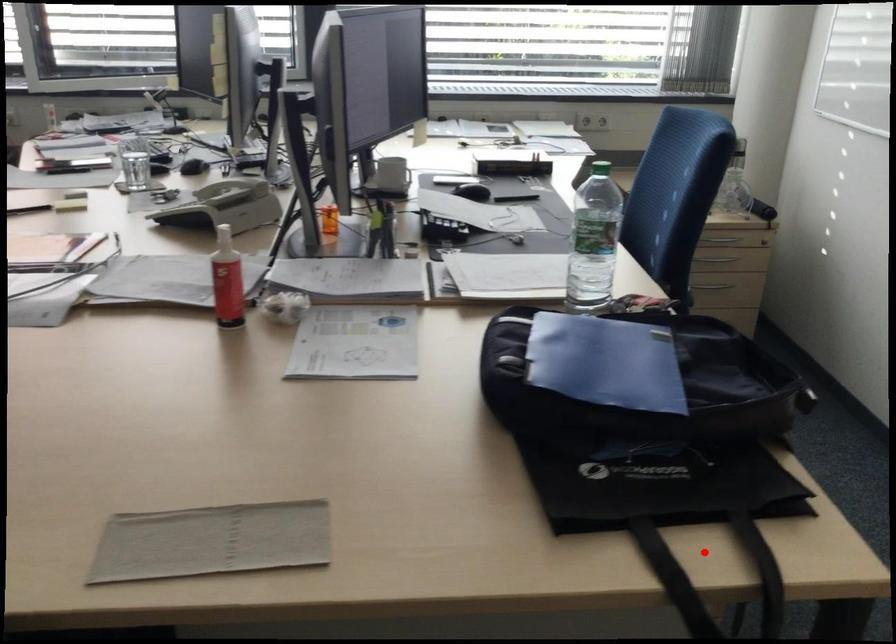
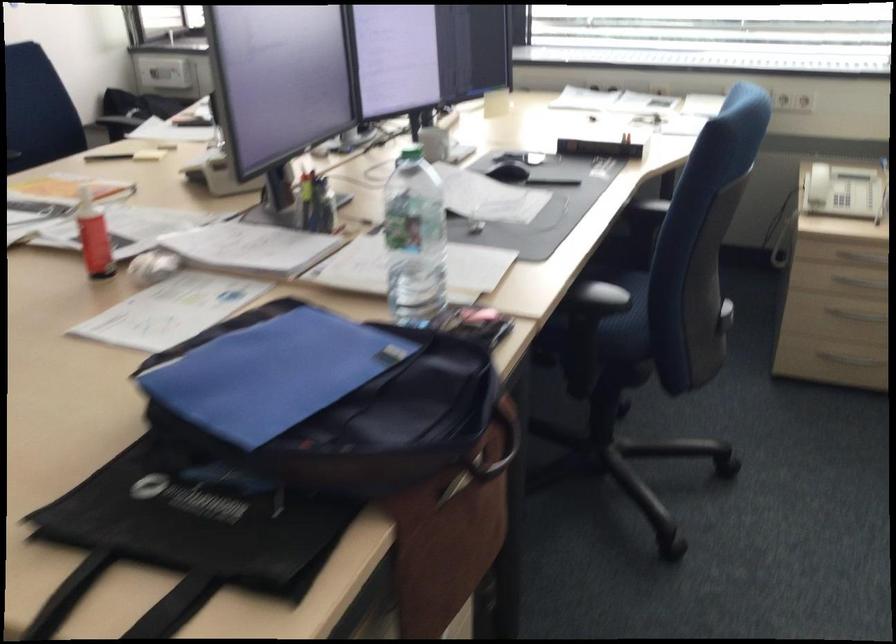
Question: I am providing you with two images of the same scene from different viewpoints. Given a red point in image1, look at the same physical point in image2. Is it:

Choices:
 (A) Closer to the viewpoint
 (B) Farther from the viewpoint

Answer: (A)